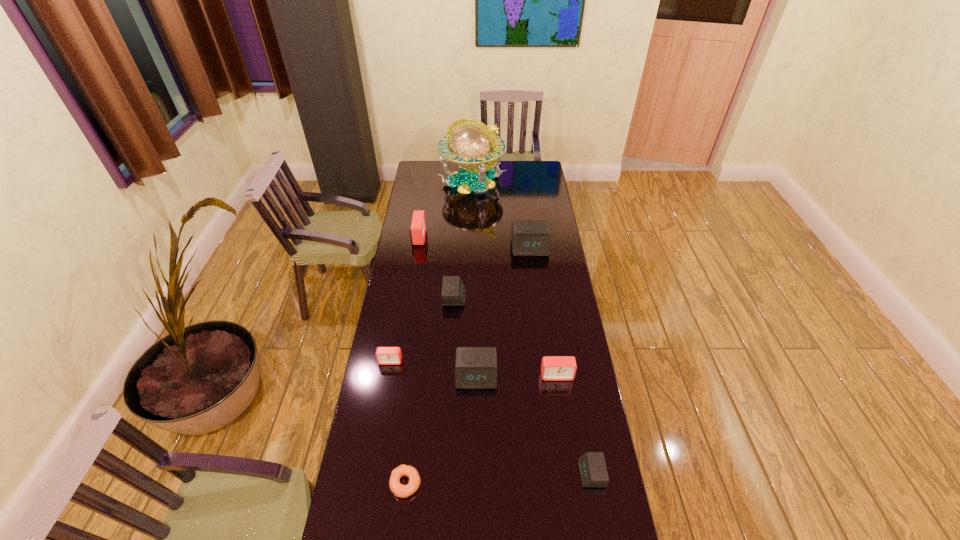
I want to click on blank space at the left edge of the desktop, so click(394, 394).

At what (x,y) coordinates should I click in order to perform the action: click on vacant area at the right edge. Please return your answer as a coordinate pair (x, y). Image resolution: width=960 pixels, height=540 pixels. Looking at the image, I should click on (565, 452).

Where is `empty location between the second farthest black alarm clock and the smallest red alarm clock`? The height and width of the screenshot is (540, 960). empty location between the second farthest black alarm clock and the smallest red alarm clock is located at coordinates (422, 329).

Locate an element on the screen. This screenshot has height=540, width=960. unoccupied position between the shortest object and the second biggest black alarm clock is located at coordinates 441,429.

The width and height of the screenshot is (960, 540). In order to click on empty location between the nearest alarm clock and the smallest red alarm clock in this screenshot , I will do `click(491, 417)`.

Find the location of a particular element. free space that is in between the second farthest black alarm clock and the farthest red alarm clock is located at coordinates (437, 267).

The width and height of the screenshot is (960, 540). Identify the location of blank region between the tallest object and the second farthest black alarm clock. (464, 239).

Find the location of `free space that is in between the farthest red alarm clock and the tan doughnut`. free space that is in between the farthest red alarm clock and the tan doughnut is located at coordinates (412, 360).

Where is `vacant area that lies between the nearest red alarm clock and the smallest black alarm clock`? vacant area that lies between the nearest red alarm clock and the smallest black alarm clock is located at coordinates (574, 424).

Image resolution: width=960 pixels, height=540 pixels. In order to click on free space between the second smallest black alarm clock and the tallest object in this screenshot , I will do `click(464, 239)`.